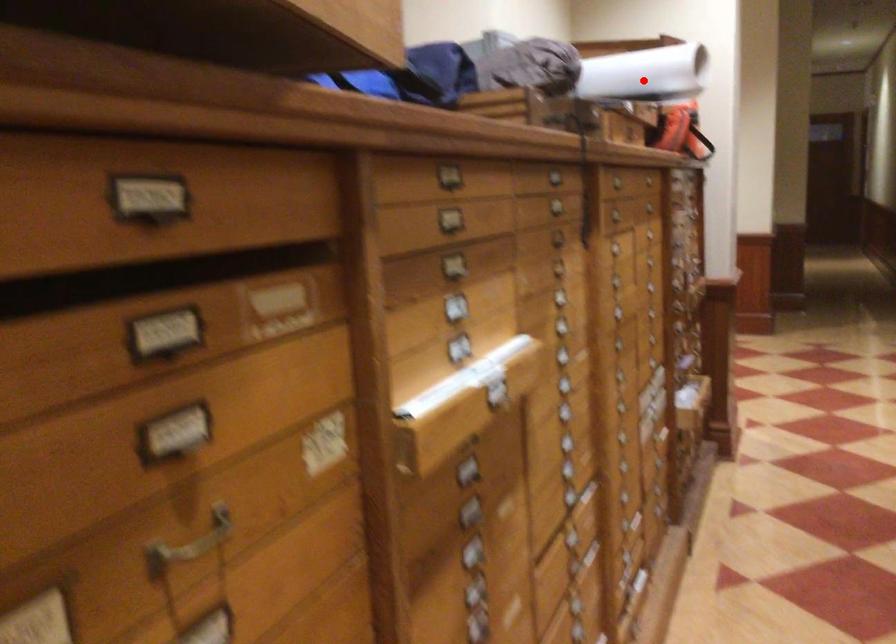
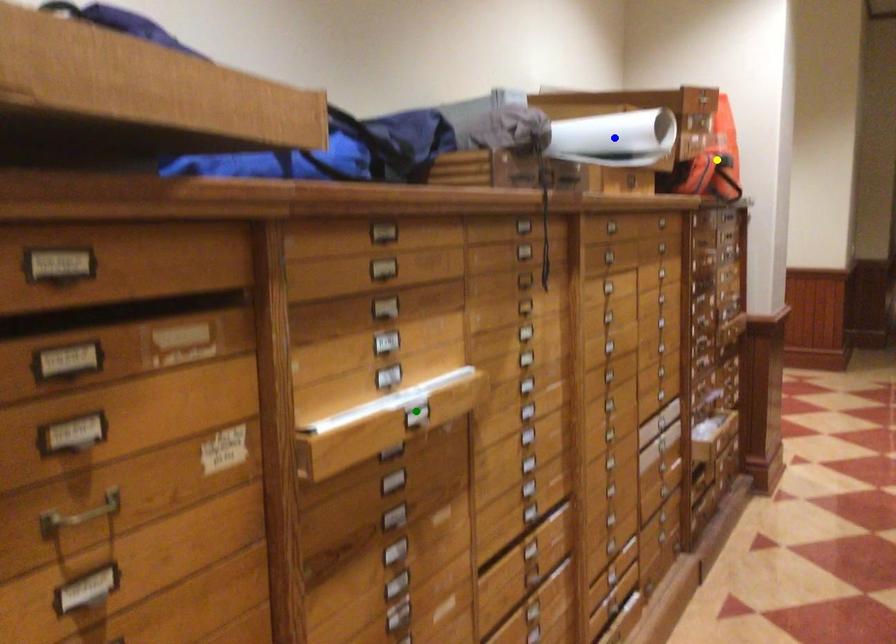
Question: I am providing you with two images of the same scene from different viewpoints. A red point is marked on the first image. You are given multiple points on the second image. Which mark in image 2 goes with the point in image 1?

Choices:
 (A) yellow point
 (B) green point
 (C) blue point

Answer: (C)